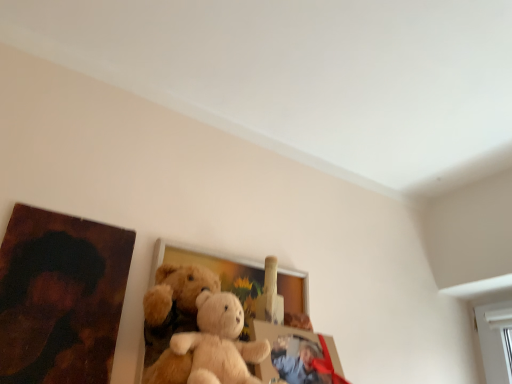
Question: From the image's perspective, is wooden picture frame at center, which is the 2th picture frame in right-to-left order, positioned above or below wooden painting at left, which ranks as the 3th picture frame in right-to-left order?

Choices:
 (A) above
 (B) below

Answer: (B)

Question: Is wooden picture frame at center, which is the 2th picture frame in right-to-left order, in front of or behind wooden painting at left, which ranks as the 3th picture frame in right-to-left order, in the image?

Choices:
 (A) front
 (B) behind

Answer: (B)

Question: Which object is positioned farthest from the matte plastic picture frame at center, the third picture frame viewed from the left?

Choices:
 (A) wooden painting at left, acting as the 1th picture frame starting from the left
 (B) wooden picture frame at center, which is the 2th picture frame from left to right

Answer: (A)

Question: Considering the real-world distances, which object is farthest from the matte plastic picture frame at center, the third picture frame viewed from the left?

Choices:
 (A) wooden picture frame at center, which is the 2th picture frame in right-to-left order
 (B) wooden painting at left, acting as the 1th picture frame starting from the left

Answer: (B)